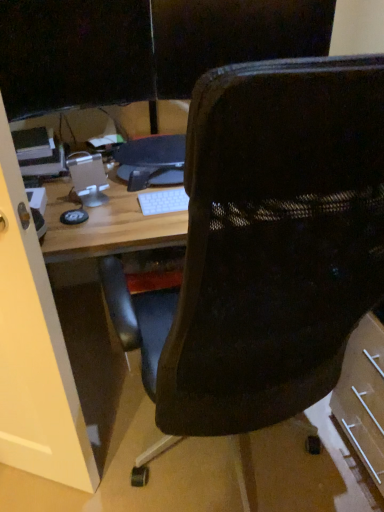
Question: From the image's perspective, is black mesh chair at center located above or below black mesh chair at upper center?

Choices:
 (A) below
 (B) above

Answer: (A)

Question: In terms of height, does black mesh chair at center look taller or shorter compared to black mesh chair at upper center?

Choices:
 (A) short
 (B) tall

Answer: (B)

Question: Based on their relative distances, which object is farther from the black plastic monitor at center?

Choices:
 (A) black mesh chair at upper center
 (B) black glossy monitor at upper left
 (C) black mesh chair at center
 (D) transparent glass door at left

Answer: (D)

Question: Which object is the closest to the black mesh chair at upper center?

Choices:
 (A) black mesh chair at center
 (B) transparent glass door at left
 (C) black glossy monitor at upper left
 (D) black plastic monitor at center

Answer: (C)